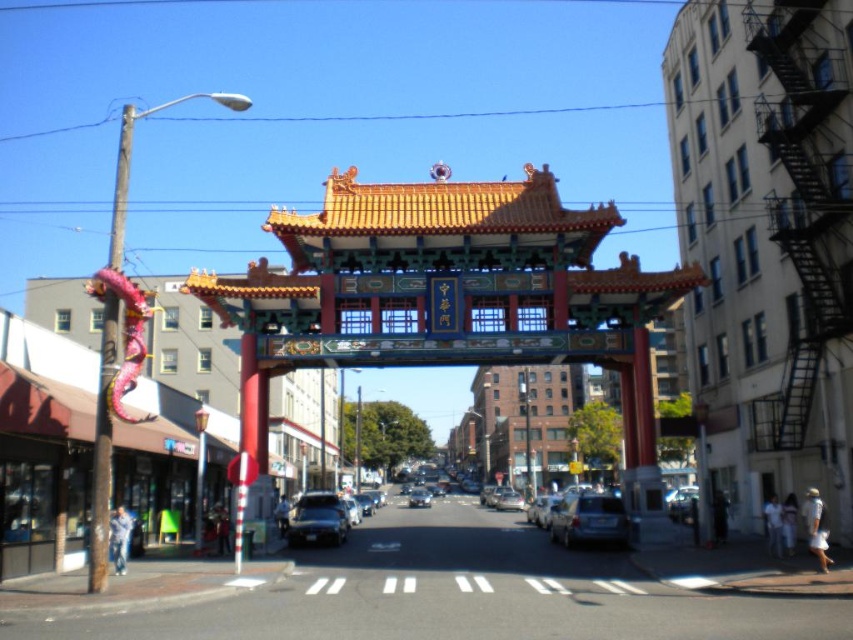
Which is below, metallic silver sedan at center or metallic silver car at center?

metallic silver car at center is below.

Does point (306, 531) come farther from viewer compared to point (416, 490)?

No, it is in front of (416, 490).

Does point (287, 536) come closer to viewer compared to point (410, 500)?

Yes, point (287, 536) is closer to viewer.

The height and width of the screenshot is (640, 853). Identify the location of metallic silver sedan at center. (318, 518).

Does point (596, 499) come farther from viewer compared to point (412, 490)?

No, it is in front of (412, 490).

What do you see at coordinates (589, 518) in the screenshot? This screenshot has height=640, width=853. I see `matte silver suv at center` at bounding box center [589, 518].

Is point (569, 545) farther from viewer compared to point (428, 502)?

No, (569, 545) is closer to viewer.

At what (x,y) coordinates should I click in order to perform the action: click on matte silver suv at center. Please return your answer as a coordinate pair (x, y). The image size is (853, 640). Looking at the image, I should click on 589,518.

Consider the image. Between matte silver suv at center and metallic silver sedan at center, which one has less height?

metallic silver sedan at center

Who is more forward, [608,499] or [328,497]?

Point [608,499] is in front.

Between point (616, 508) and point (320, 509), which one is positioned behind?

The point (320, 509) is behind.

Find the location of a particular element. matte silver suv at center is located at coordinates (589, 518).